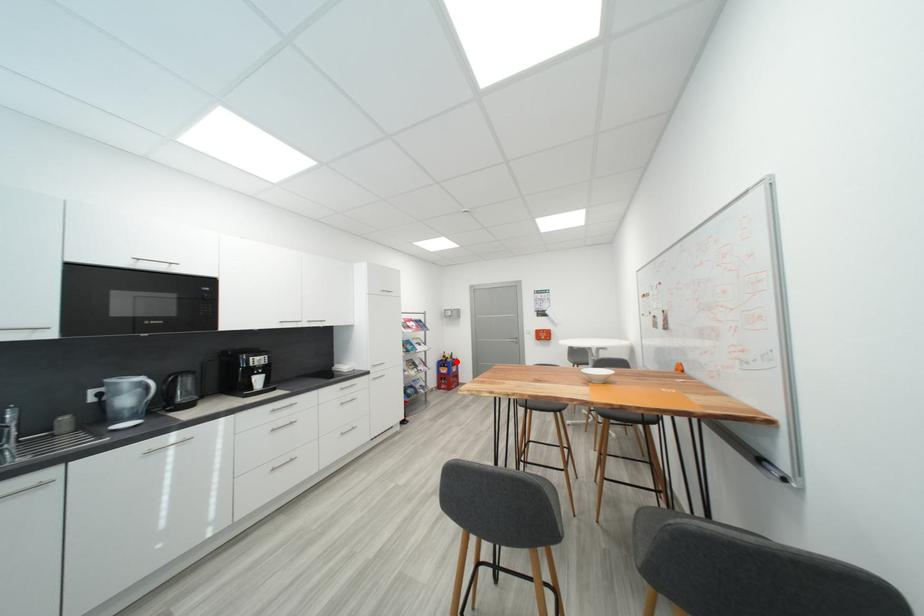
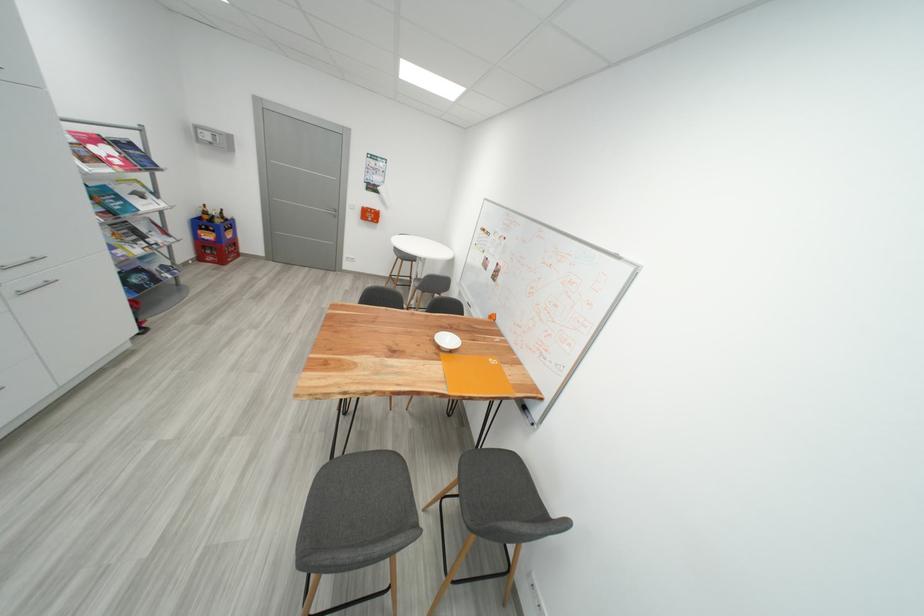
Question: I am providing you with two images of the same scene from different viewpoints. A red point is marked on the first image. Can you still see the location of the red point in image 2?

Choices:
 (A) Yes
 (B) No

Answer: (A)